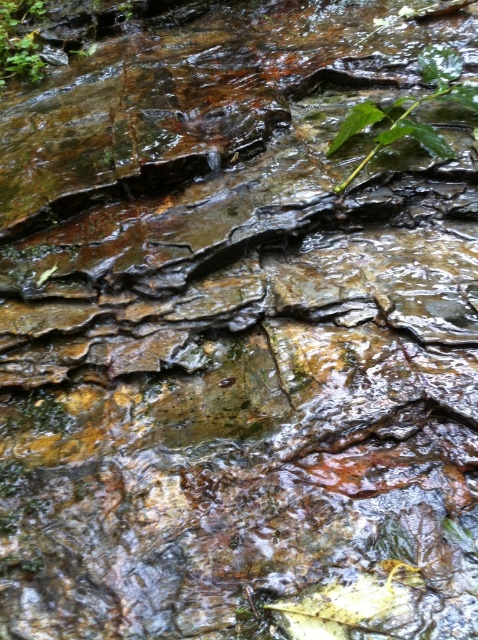
Question: Is green leafy plant at upper right to the right of green leafy plant at upper left from the viewer's perspective?

Choices:
 (A) no
 (B) yes

Answer: (B)

Question: Is green leafy plant at upper right to the right of green leafy plant at upper left from the viewer's perspective?

Choices:
 (A) yes
 (B) no

Answer: (A)

Question: Which of the following is the farthest from the observer?

Choices:
 (A) (6, 3)
 (B) (445, 67)

Answer: (A)

Question: Where is green leafy plant at upper right located in relation to green leafy plant at upper left in the image?

Choices:
 (A) above
 (B) below

Answer: (B)

Question: Which object appears closest to the camera in this image?

Choices:
 (A) green leafy plant at upper right
 (B) green leafy plant at upper left

Answer: (A)